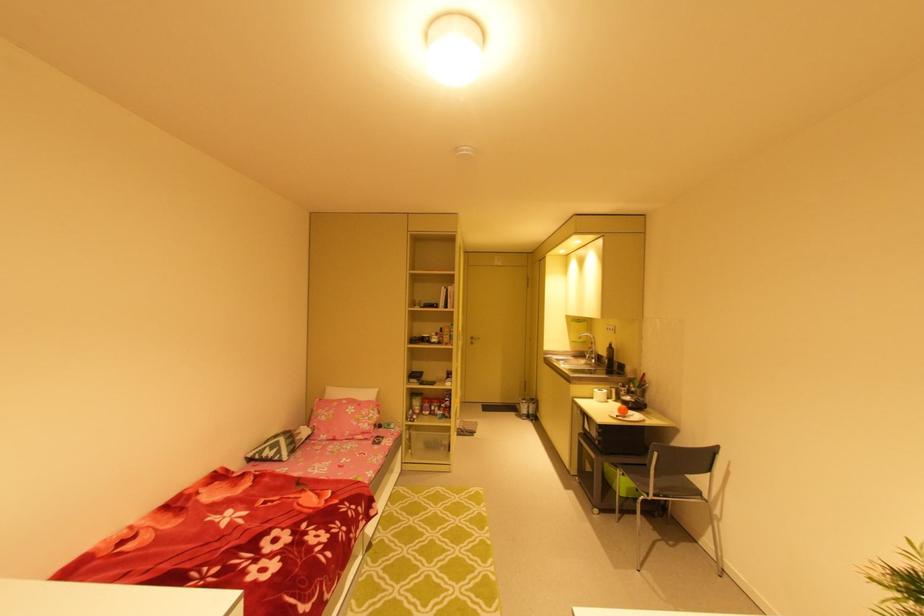
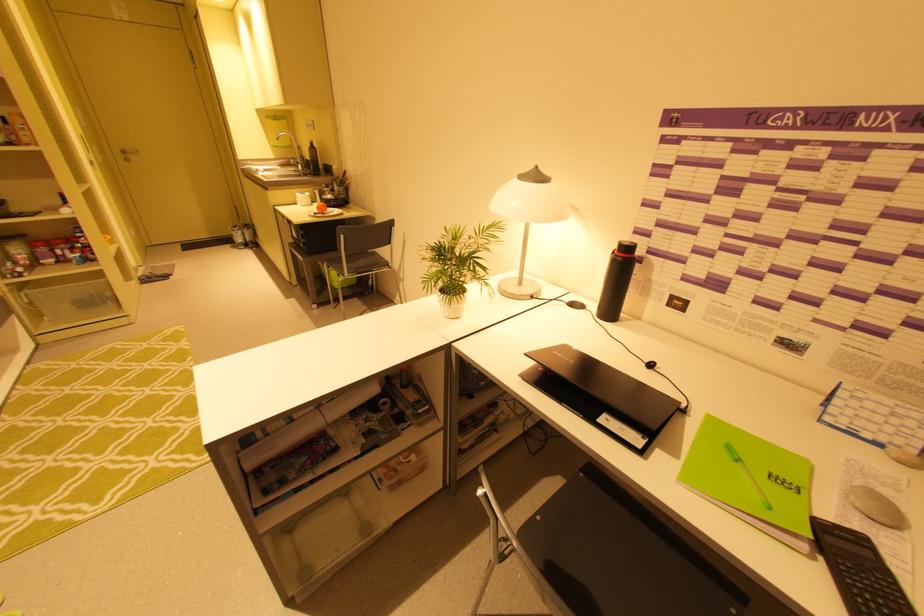
Locate, in the second image, the point that corresponds to the point at 613,346 in the first image.

(313, 146)